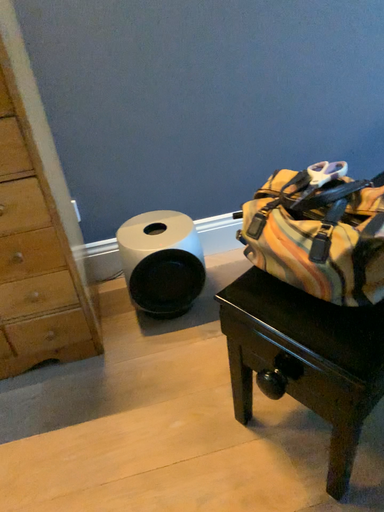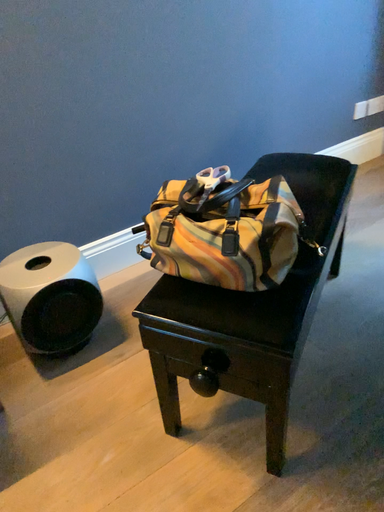
Question: Which way did the camera rotate in the video?

Choices:
 (A) rotated right
 (B) rotated left

Answer: (A)